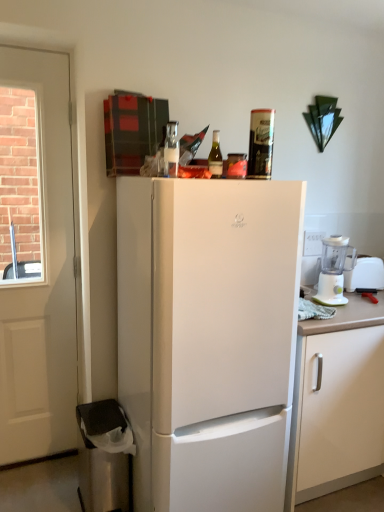
Question: Do you think white wooden door at left is within white plastic blender at right, or outside of it?

Choices:
 (A) inside
 (B) outside

Answer: (B)

Question: Is white wooden door at left in front of or behind white plastic blender at right in the image?

Choices:
 (A) behind
 (B) front

Answer: (B)

Question: Estimate the real-world distances between objects in this image. Which object is closer to the green glass bottle at top, marked as the second bottle in a left-to-right arrangement?

Choices:
 (A) clear glass bottle at upper center, which is the second bottle in right-to-left order
 (B) white wooden door at left
 (C) white plastic blender at right
 (D) white plastic blender at right
 (E) white matte cabinet at right

Answer: (A)

Question: Based on their relative distances, which object is farther from the white plastic blender at right?

Choices:
 (A) green glass bottle at top, which appears as the first bottle when viewed from the right
 (B) white matte refrigerator at center
 (C) white wooden door at left
 (D) white matte cabinet at right
 (E) white plastic blender at right

Answer: (C)